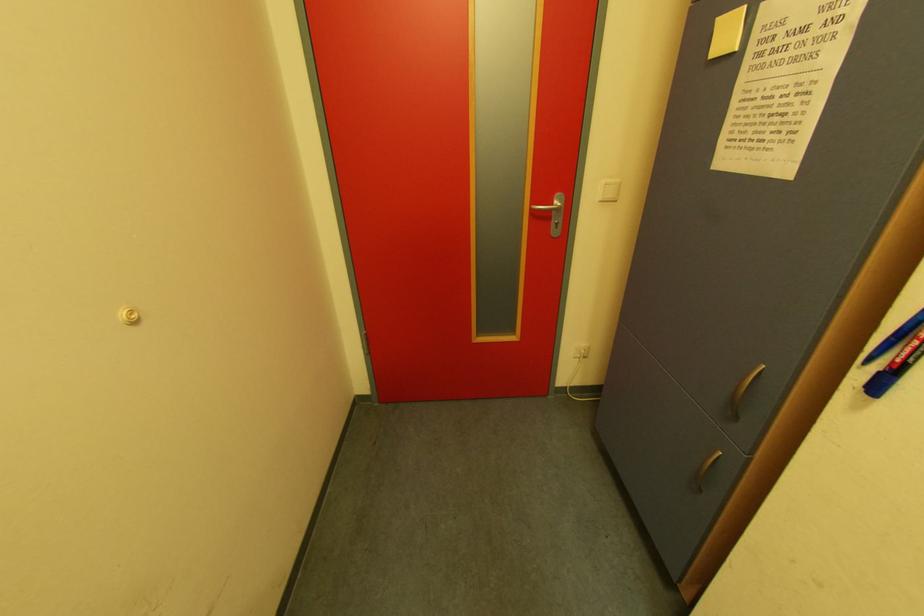
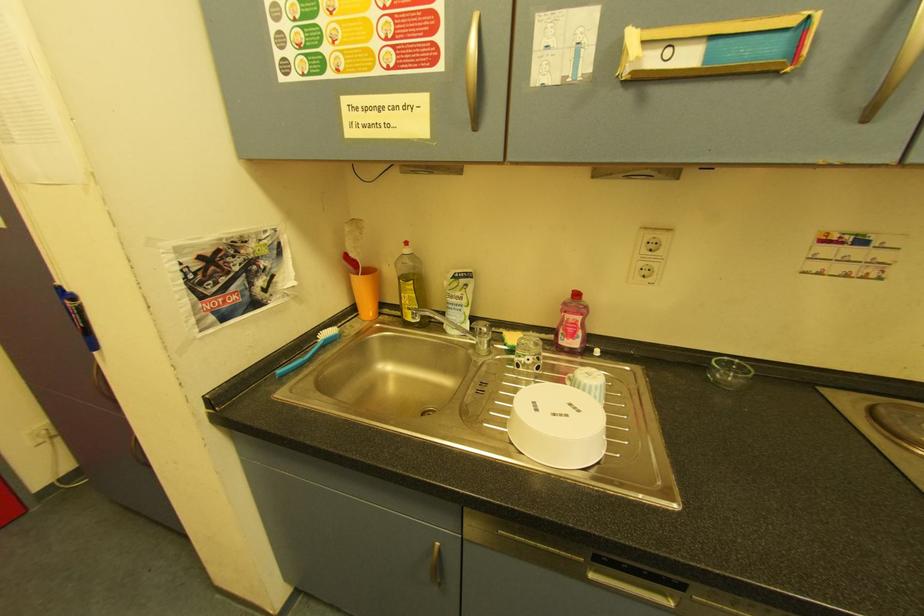
Question: The first image is from the beginning of the video and the second image is from the end. How did the camera likely rotate when shooting the video?

Choices:
 (A) Left
 (B) Right
 (C) Up
 (D) Down

Answer: (B)